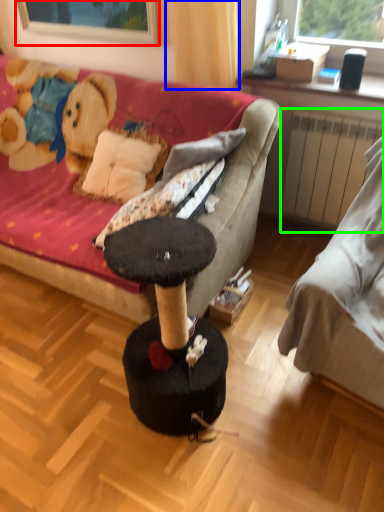
Question: Considering the real-world distances, which object is farthest from window screen (highlighted by a red box)? curtain (highlighted by a blue box) or radiator (highlighted by a green box)?

Choices:
 (A) curtain
 (B) radiator

Answer: (B)